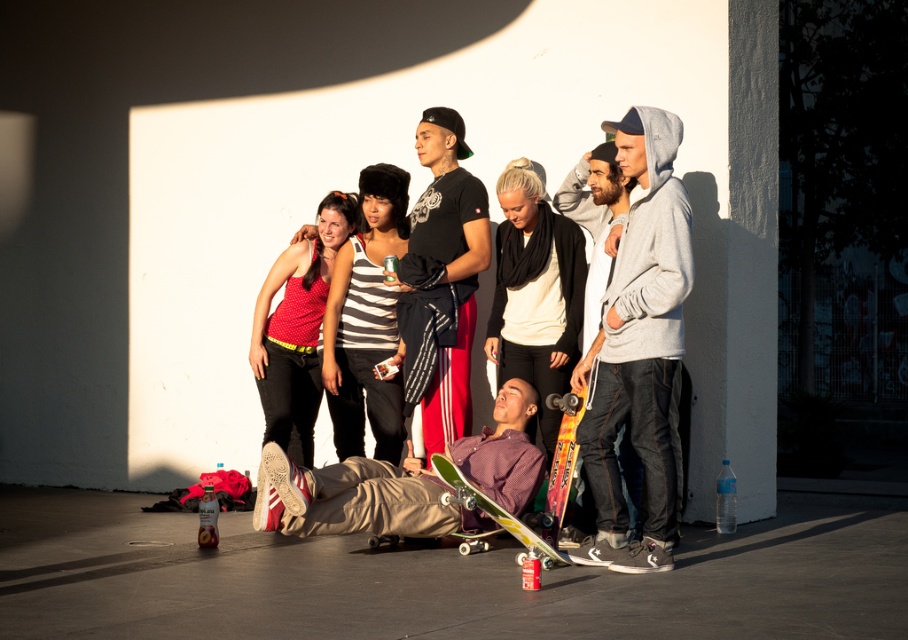
Does black matte shirt at center appear under wooden skateboard at center?

Incorrect, black matte shirt at center is not positioned below wooden skateboard at center.

Which is more to the right, black matte shirt at center or wooden skateboard at center?

From the viewer's perspective, black matte shirt at center appears more on the right side.

Which is in front, point (441, 268) or point (495, 492)?

Positioned in front is point (495, 492).

The image size is (908, 640). Find the location of `black matte shirt at center`. black matte shirt at center is located at coordinates (442, 280).

Is wooden skateboard at center taller than green wooden skateboard at center?

Correct, wooden skateboard at center is much taller as green wooden skateboard at center.

Can you confirm if wooden skateboard at center is bigger than green wooden skateboard at center?

Yes, wooden skateboard at center is bigger than green wooden skateboard at center.

Between point (395, 486) and point (492, 515), which one is positioned in front?

Positioned in front is point (492, 515).

The width and height of the screenshot is (908, 640). I want to click on wooden skateboard at center, so click(x=358, y=499).

Is gray hoodie at right wider than orange wood skateboard at lower center?

Indeed, gray hoodie at right has a greater width compared to orange wood skateboard at lower center.

Which of these two, gray hoodie at right or orange wood skateboard at lower center, stands shorter?

With less height is orange wood skateboard at lower center.

Does point (654, 125) lie in front of point (561, 513)?

That is True.

Image resolution: width=908 pixels, height=640 pixels. I want to click on gray hoodie at right, so click(638, 346).